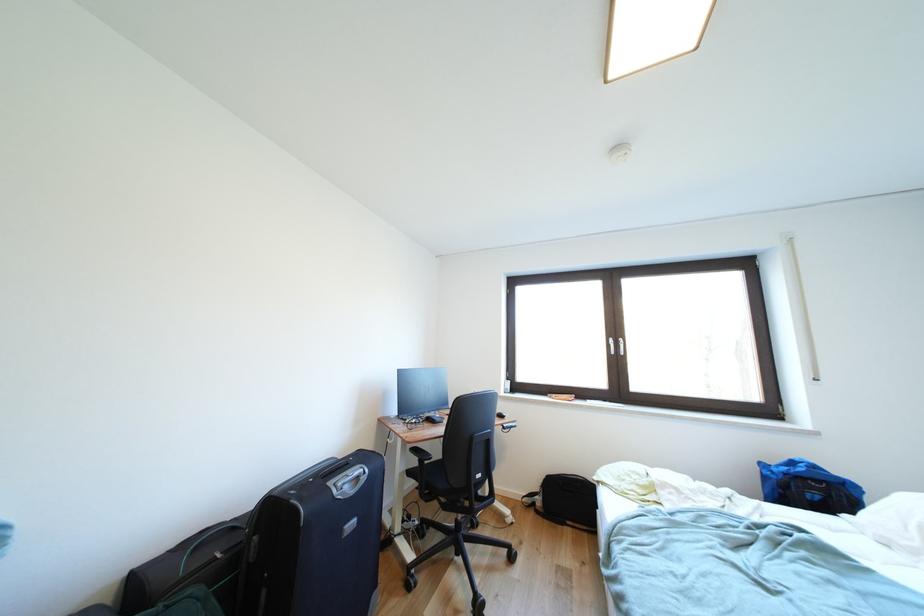
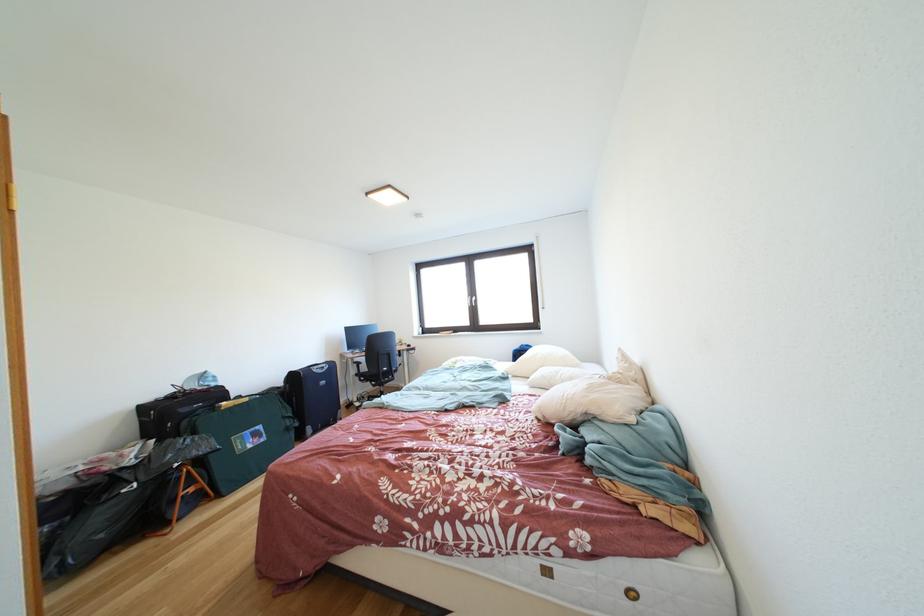
Find the pixel in the second image that matches point (822, 471) in the first image.

(535, 351)